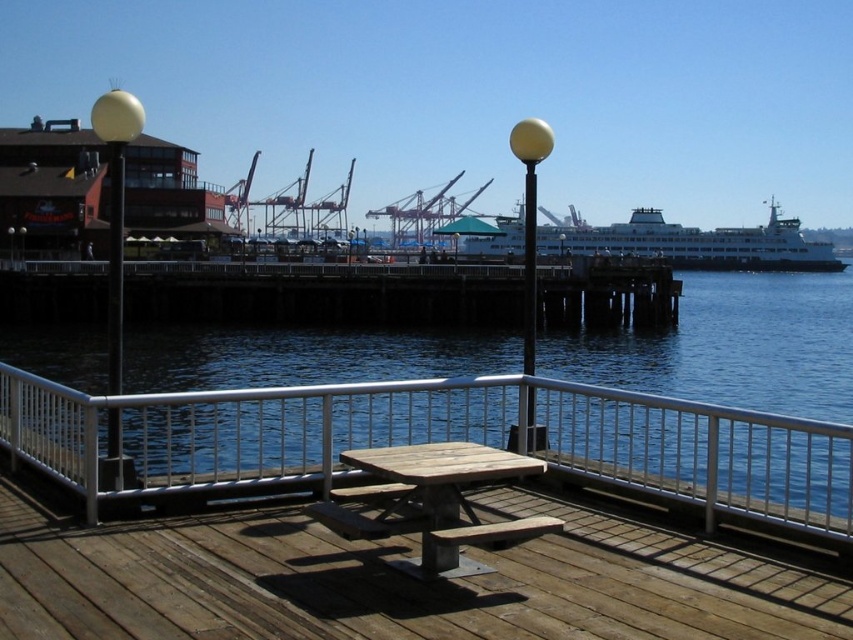
Can you confirm if white matte ferry at center is taller than metallic pole at left?

Yes.

Which is above, white matte ferry at center or metallic pole at left?

white matte ferry at center

This screenshot has height=640, width=853. What are the coordinates of `white matte ferry at center` in the screenshot? It's located at (689, 243).

Can you confirm if metallic pole at left is smaller than yellow glossy pole at center?

Incorrect, metallic pole at left is not smaller in size than yellow glossy pole at center.

Does metallic pole at left have a lesser width compared to yellow glossy pole at center?

In fact, metallic pole at left might be wider than yellow glossy pole at center.

Who is more forward, (112, 227) or (532, 362)?

Point (112, 227) is in front.

This screenshot has width=853, height=640. Find the location of `metallic pole at left`. metallic pole at left is located at coordinates (115, 268).

Based on the photo, can you confirm if white metal railing at center is smaller than yellow glossy pole at center?

Yes.

Can you confirm if white metal railing at center is shorter than yellow glossy pole at center?

Correct, white metal railing at center is not as tall as yellow glossy pole at center.

Locate an element on the screen. The image size is (853, 640). white metal railing at center is located at coordinates (440, 440).